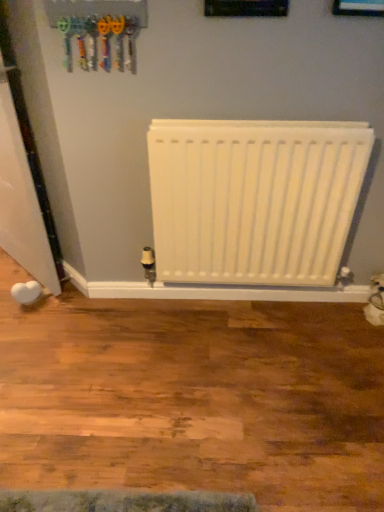
Question: Can you confirm if blue glossy picture frame at upper center is smaller than white glossy door at left?

Choices:
 (A) yes
 (B) no

Answer: (A)

Question: Is blue glossy picture frame at upper center thinner than white glossy door at left?

Choices:
 (A) no
 (B) yes

Answer: (B)

Question: From the image's perspective, is blue glossy picture frame at upper center on white glossy door at left?

Choices:
 (A) yes
 (B) no

Answer: (A)

Question: Is blue glossy picture frame at upper center further to camera compared to white glossy door at left?

Choices:
 (A) no
 (B) yes

Answer: (A)

Question: Can you confirm if blue glossy picture frame at upper center is taller than white glossy door at left?

Choices:
 (A) yes
 (B) no

Answer: (B)

Question: Is blue glossy picture frame at upper center far away from white glossy door at left?

Choices:
 (A) yes
 (B) no

Answer: (A)

Question: Is blue glossy picture frame at upper center oriented away from white matte radiator at center?

Choices:
 (A) yes
 (B) no

Answer: (B)

Question: Is blue glossy picture frame at upper center at the left side of white matte radiator at center?

Choices:
 (A) no
 (B) yes

Answer: (A)

Question: From the image's perspective, is blue glossy picture frame at upper center beneath white matte radiator at center?

Choices:
 (A) no
 (B) yes

Answer: (A)

Question: Is blue glossy picture frame at upper center at the right side of white matte radiator at center?

Choices:
 (A) yes
 (B) no

Answer: (A)

Question: From the image's perspective, is blue glossy picture frame at upper center on top of white matte radiator at center?

Choices:
 (A) no
 (B) yes

Answer: (B)

Question: Does blue glossy picture frame at upper center have a lesser height compared to white matte radiator at center?

Choices:
 (A) yes
 (B) no

Answer: (A)

Question: From a real-world perspective, is white glossy door at left positioned under white matte radiator at center based on gravity?

Choices:
 (A) yes
 (B) no

Answer: (B)